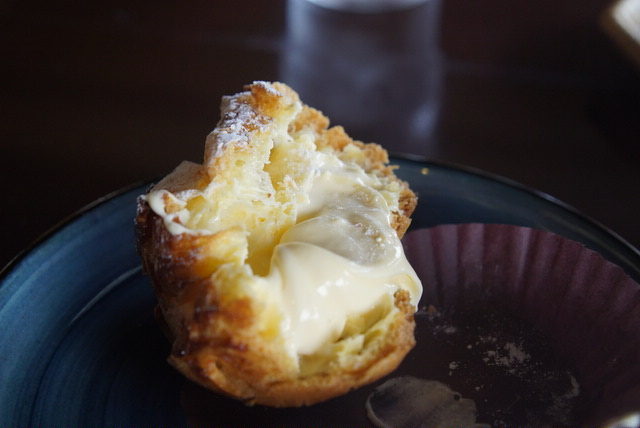
The image size is (640, 428). What are the coordinates of `black rim of bowl` in the screenshot? It's located at (73, 220).